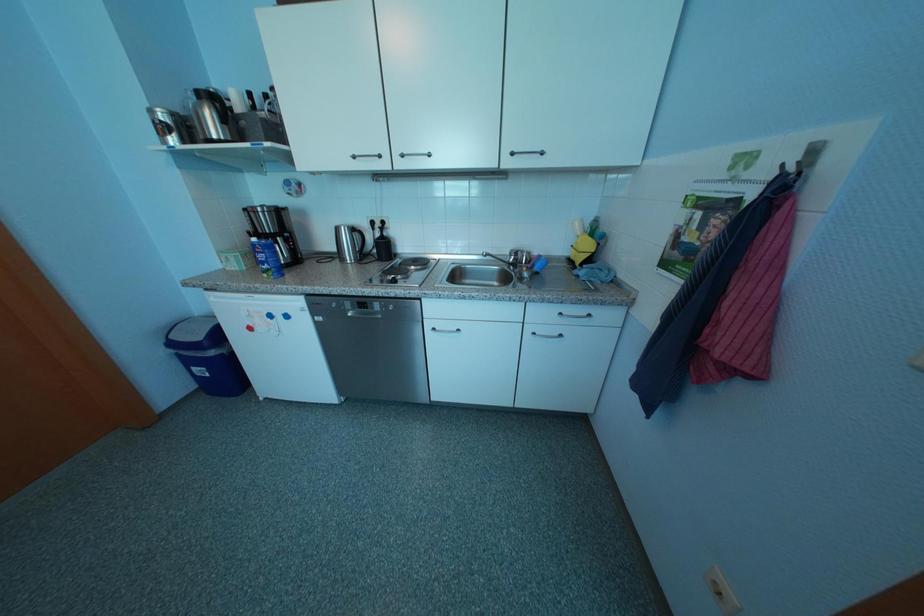
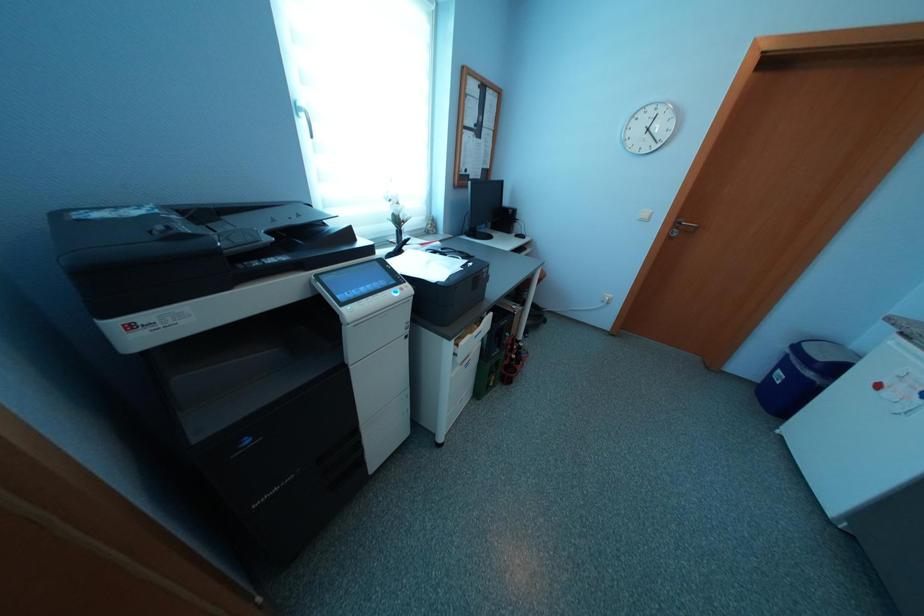
The images are taken continuously from a first-person perspective. In which direction is your viewpoint rotating?

The rotation direction of the camera is left-down.